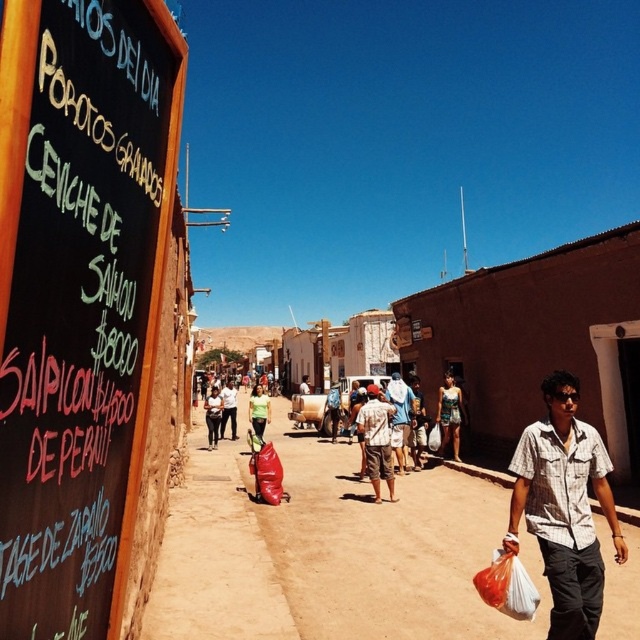
Consider the image. Does light brown fabric shirt at center have a greater height compared to blue denim dress at center?

No, light brown fabric shirt at center is not taller than blue denim dress at center.

Between light brown fabric shirt at center and blue denim dress at center, which one has less height?

Standing shorter between the two is light brown fabric shirt at center.

Which is behind, point (387, 458) or point (444, 424)?

The point (444, 424) is more distant.

Where is `light brown fabric shirt at center`? Image resolution: width=640 pixels, height=640 pixels. light brown fabric shirt at center is located at coordinates (378, 440).

Does light brown fabric shirt at center have a lesser height compared to green fabric bag at center?

No, light brown fabric shirt at center is not shorter than green fabric bag at center.

Can you confirm if light brown fabric shirt at center is taller than green fabric bag at center?

Yes, light brown fabric shirt at center is taller than green fabric bag at center.

Describe the element at coordinates (378, 440) in the screenshot. I see `light brown fabric shirt at center` at that location.

Locate an element on the screen. The width and height of the screenshot is (640, 640). light brown fabric shirt at center is located at coordinates (378, 440).

Is brown dirt alley at center smaller than blue denim dress at center?

No, brown dirt alley at center is not smaller than blue denim dress at center.

This screenshot has height=640, width=640. Find the location of `brown dirt alley at center`. brown dirt alley at center is located at coordinates (326, 552).

Is point (396, 620) closer to viewer compared to point (451, 392)?

That is True.

Identify the location of brown dirt alley at center. (326, 552).